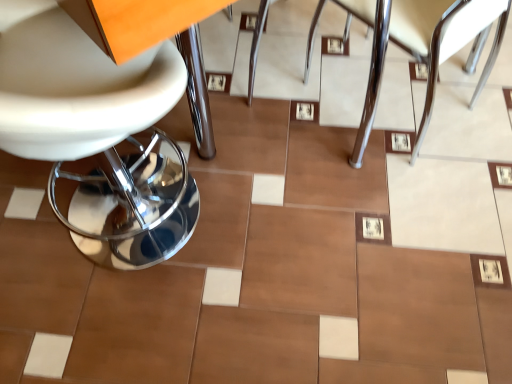
Question: Considering the relative sizes of satin chrome chair at center, marked as the first chair in a right-to-left arrangement, and white leather chair at left, the 1th chair from the left, in the image provided, is satin chrome chair at center, marked as the first chair in a right-to-left arrangement, bigger than white leather chair at left, the 1th chair from the left,?

Choices:
 (A) no
 (B) yes

Answer: (A)

Question: From the image's perspective, is satin chrome chair at center, which is the second chair in left-to-right order, on top of white leather chair at left, marked as the second chair in a right-to-left arrangement?

Choices:
 (A) yes
 (B) no

Answer: (A)

Question: Does satin chrome chair at center, which is the second chair in left-to-right order, appear on the left side of white leather chair at left, the 1th chair from the left?

Choices:
 (A) yes
 (B) no

Answer: (B)

Question: Is satin chrome chair at center, which is the second chair in left-to-right order, further to the viewer compared to white leather chair at left, the 1th chair from the left?

Choices:
 (A) no
 (B) yes

Answer: (B)

Question: Can you confirm if satin chrome chair at center, marked as the first chair in a right-to-left arrangement, is thinner than white leather chair at left, marked as the second chair in a right-to-left arrangement?

Choices:
 (A) yes
 (B) no

Answer: (B)

Question: Is satin chrome chair at center, marked as the first chair in a right-to-left arrangement, positioned in front of white leather chair at left, the 1th chair from the left?

Choices:
 (A) yes
 (B) no

Answer: (B)

Question: Is white leather chair at left, marked as the second chair in a right-to-left arrangement, not inside satin chrome chair at center, marked as the first chair in a right-to-left arrangement?

Choices:
 (A) yes
 (B) no

Answer: (A)

Question: Is white leather chair at left, marked as the second chair in a right-to-left arrangement, positioned with its back to satin chrome chair at center, marked as the first chair in a right-to-left arrangement?

Choices:
 (A) no
 (B) yes

Answer: (A)

Question: Considering the relative sizes of white leather chair at left, marked as the second chair in a right-to-left arrangement, and satin chrome chair at center, which is the second chair in left-to-right order, in the image provided, is white leather chair at left, marked as the second chair in a right-to-left arrangement, wider than satin chrome chair at center, which is the second chair in left-to-right order,?

Choices:
 (A) yes
 (B) no

Answer: (B)

Question: Is white leather chair at left, marked as the second chair in a right-to-left arrangement, facing towards satin chrome chair at center, marked as the first chair in a right-to-left arrangement?

Choices:
 (A) yes
 (B) no

Answer: (A)

Question: Is white leather chair at left, marked as the second chair in a right-to-left arrangement, thinner than satin chrome chair at center, marked as the first chair in a right-to-left arrangement?

Choices:
 (A) no
 (B) yes

Answer: (B)

Question: Considering the relative positions of white leather chair at left, the 1th chair from the left, and satin chrome chair at center, marked as the first chair in a right-to-left arrangement, in the image provided, is white leather chair at left, the 1th chair from the left, to the left of satin chrome chair at center, marked as the first chair in a right-to-left arrangement, from the viewer's perspective?

Choices:
 (A) no
 (B) yes

Answer: (B)

Question: Is satin chrome chair at center, marked as the first chair in a right-to-left arrangement, inside the boundaries of white leather chair at left, the 1th chair from the left, or outside?

Choices:
 (A) outside
 (B) inside

Answer: (A)